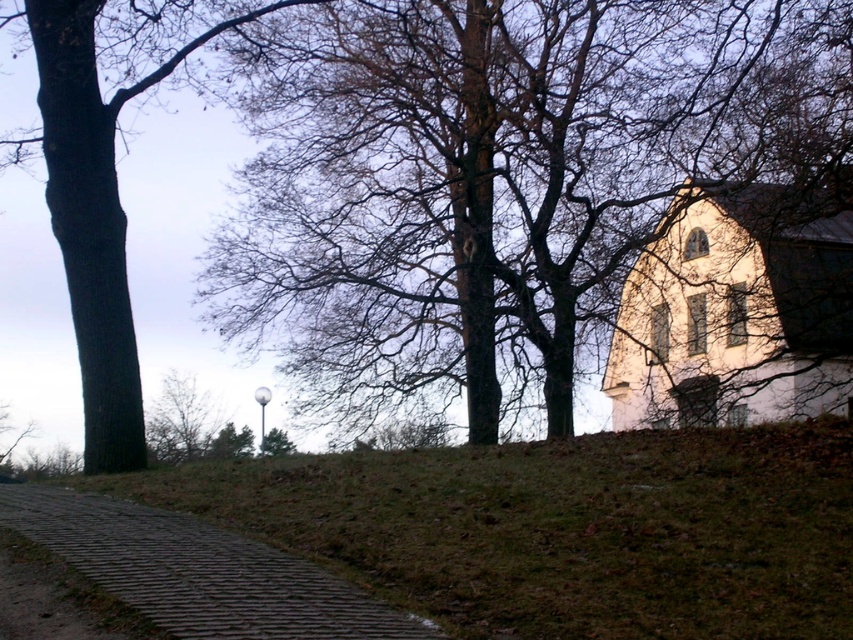
Question: Among these points, which one is nearest to the camera?

Choices:
 (A) (711, 100)
 (B) (86, 349)
 (C) (332, 595)

Answer: (C)

Question: Is brown rough tree at center in front of dark brown bark tree at left?

Choices:
 (A) yes
 (B) no

Answer: (B)

Question: Among these points, which one is nearest to the camera?

Choices:
 (A) (764, 298)
 (B) (554, 420)
 (C) (215, 618)

Answer: (C)

Question: Is brown cobblestone path at lower left in front of dark brown bark tree at left?

Choices:
 (A) no
 (B) yes

Answer: (B)

Question: Among these points, which one is nearest to the camera?

Choices:
 (A) (96, 8)
 (B) (408, 634)
 (C) (741, 412)
 (D) (235, 49)

Answer: (B)

Question: Can you confirm if white matte church at upper right is bigger than brown cobblestone path at lower left?

Choices:
 (A) no
 (B) yes

Answer: (B)